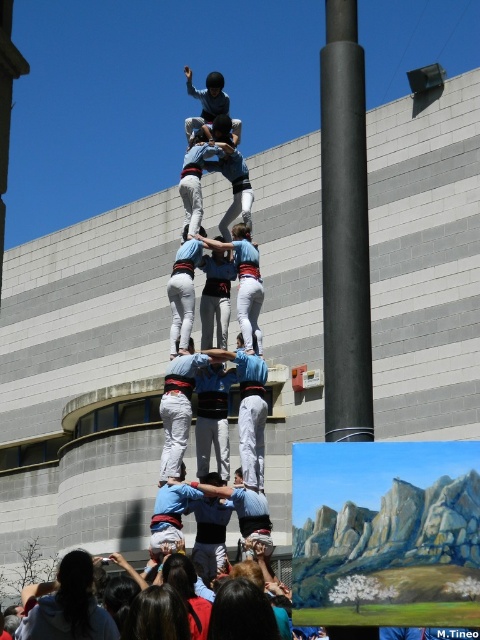
You are an architect designing a safety barrier around the black smooth pole at center and light blue fabric shirt at center. Which object requires a larger barrier to accommodate its size?

The light blue fabric shirt at center requires a larger barrier because it has a bigger size compared to the black smooth pole at center.

You are a photographer trying to capture the human tower. You notice the black smooth pole at center and the white cotton pants at center in your frame. Which object should you adjust your camera to focus on if you want to ensure the wider object is in focus?

The black smooth pole at center might be wider than white cotton pants at center, so you should focus on the black smooth pole at center to ensure the wider object is in focus.

You are a photographer trying to capture the human tower. You notice the white cotton pants at center and the light blue fabric at center. Which clothing item appears narrower in the photo?

The white cotton pants at center appears narrower because its width is less than the light blue fabric at center.